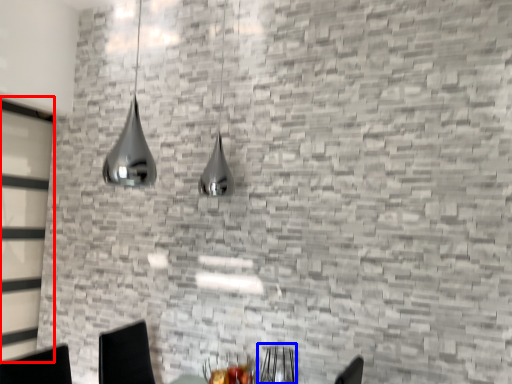
Question: Which object appears closest to the camera in this image, glass door (highlighted by a red box) or armchair (highlighted by a blue box)?

Choices:
 (A) glass door
 (B) armchair

Answer: (B)